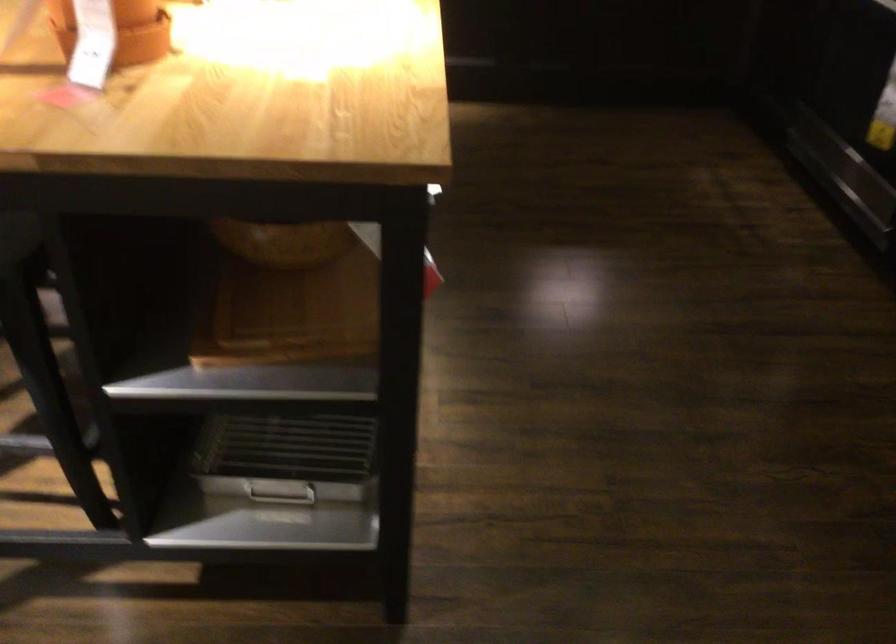
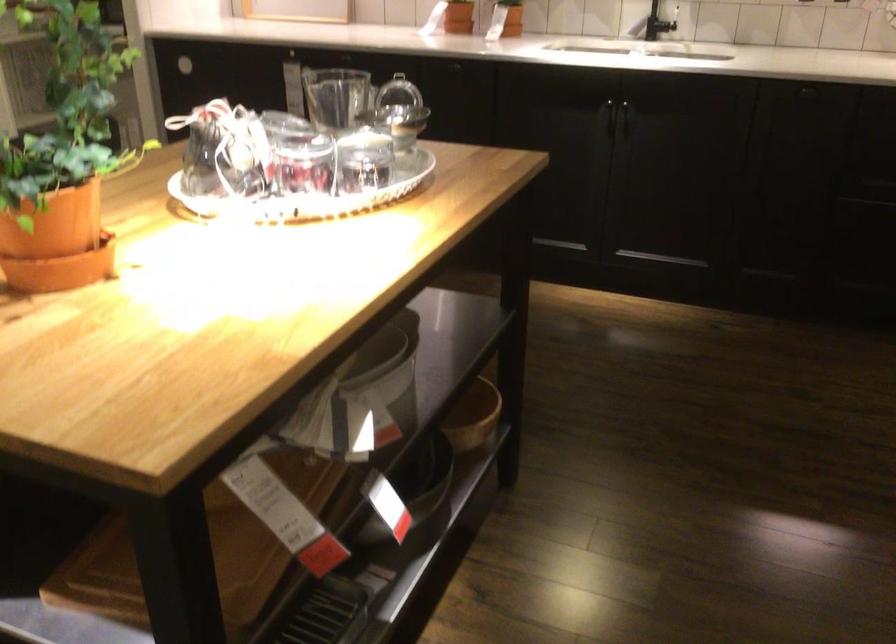
What movement of the cameraman would produce the second image?

The cameraman moved toward right, forward.